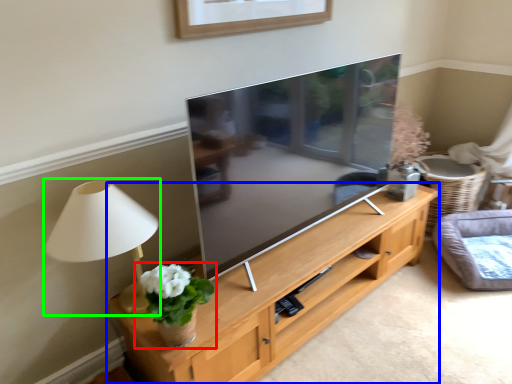
Question: Estimate the real-world distances between objects in this image. Which object is farther from houseplant (highlighted by a red box), shelf (highlighted by a blue box) or table lamp (highlighted by a green box)?

Choices:
 (A) shelf
 (B) table lamp

Answer: (A)